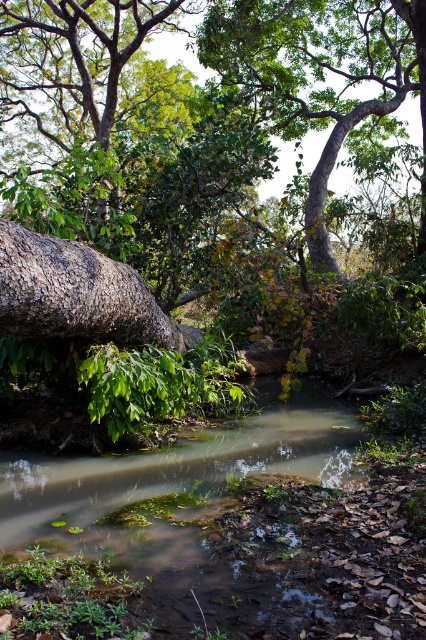
Which of these two, green mossy river at center or green leafy tree at upper left, stands shorter?

With less height is green mossy river at center.

Does point (219, 621) come in front of point (9, 113)?

Yes, point (219, 621) is closer to viewer.

Is point (270, 611) closer to viewer compared to point (109, 38)?

Yes, point (270, 611) is in front of point (109, 38).

The image size is (426, 640). What are the coordinates of `green mossy river at center` in the screenshot? It's located at (206, 536).

Which is behind, point (287, 433) or point (420, 1)?

The point (420, 1) is more distant.

Between point (311, 573) and point (305, 42), which one is positioned behind?

Point (305, 42)

Locate an element on the screen. Image resolution: width=426 pixels, height=640 pixels. green mossy river at center is located at coordinates (206, 536).

Is green leafy tree at upper left shorter than green rough bark tree at upper center?

Incorrect, green leafy tree at upper left's height does not fall short of green rough bark tree at upper center's.

Does green leafy tree at upper left have a smaller size compared to green rough bark tree at upper center?

Actually, green leafy tree at upper left might be larger than green rough bark tree at upper center.

The height and width of the screenshot is (640, 426). In order to click on green leafy tree at upper left in this screenshot , I will do `click(71, 109)`.